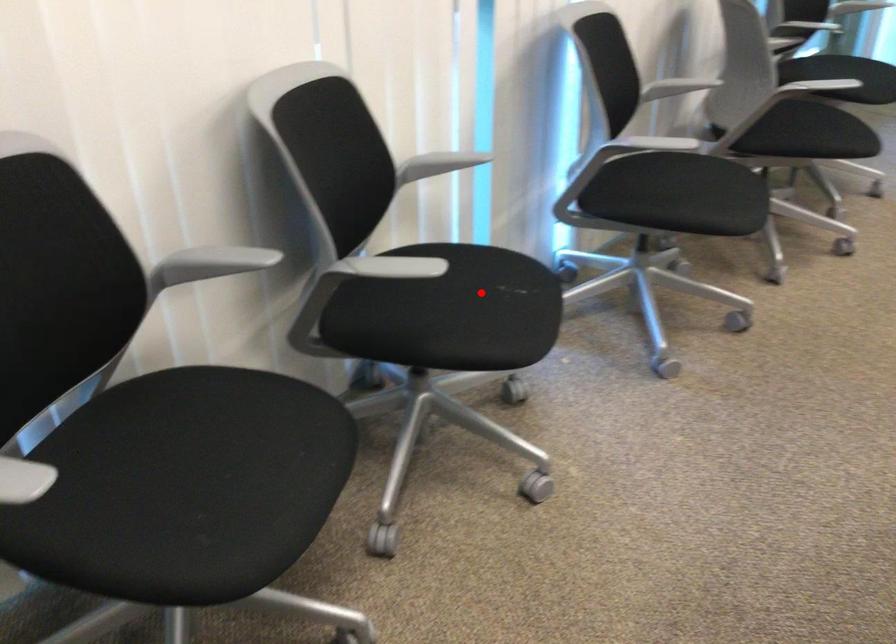
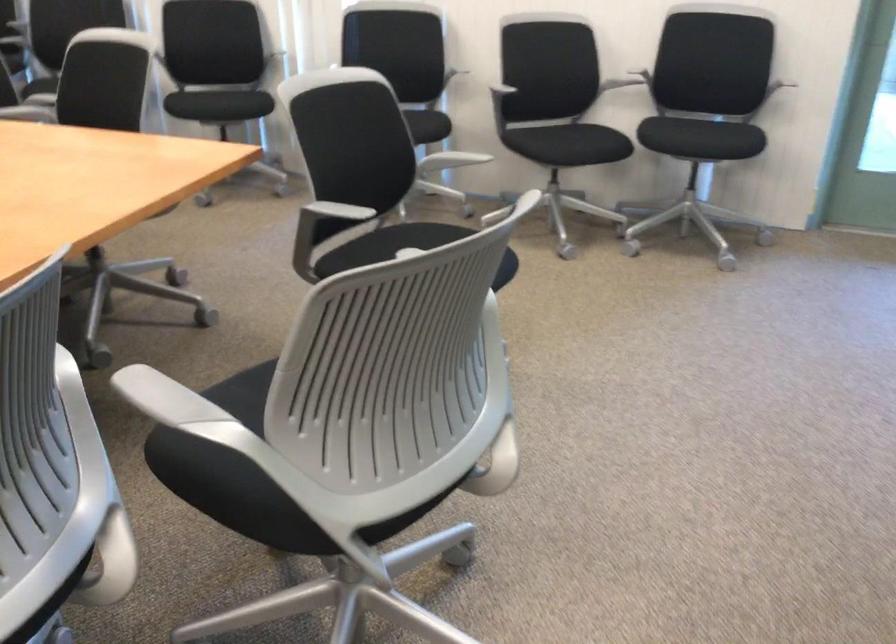
Question: I am providing you with two images of the same scene from different viewpoints. A red point is shown in image1. For the corresponding object point in image2, is it positioned nearer or farther from the camera?

Choices:
 (A) Nearer
 (B) Farther

Answer: (B)